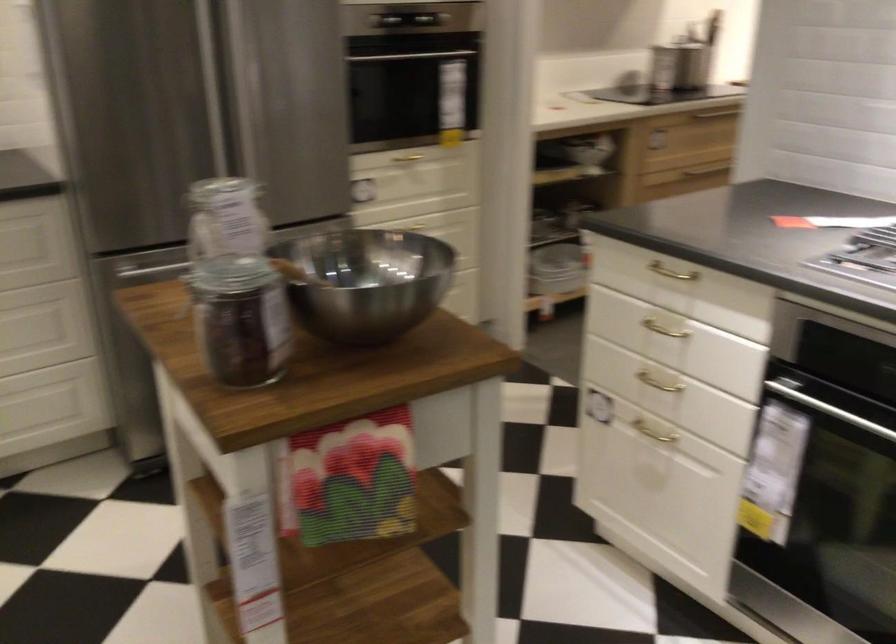
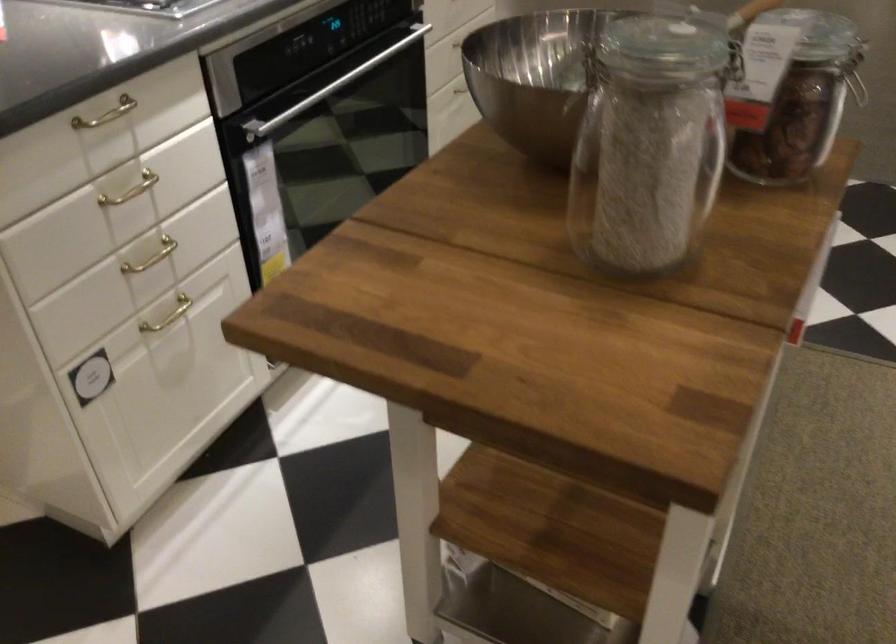
Where in the second image is the point corresponding to pixel 657 263 from the first image?

(106, 114)